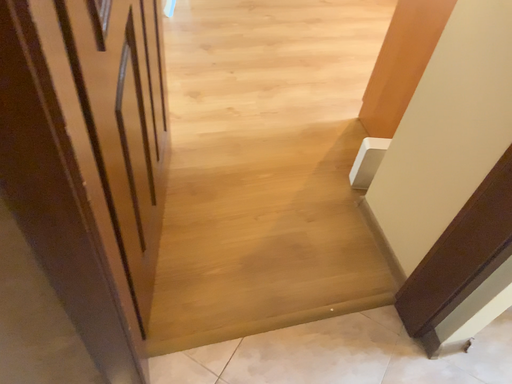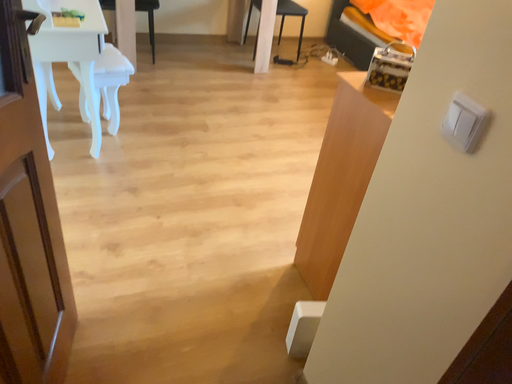
Question: Which way did the camera rotate in the video?

Choices:
 (A) rotated downward
 (B) rotated upward

Answer: (B)